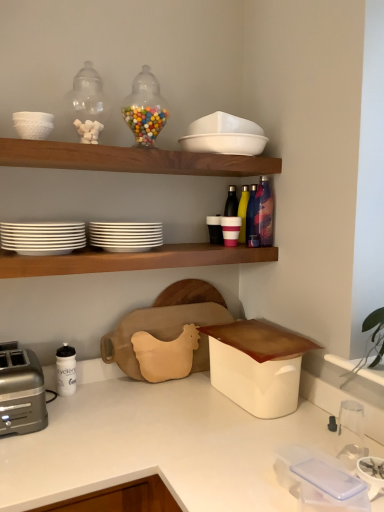
Question: Is metallic multi-colored bottle at upper right, arranged as the third bottle when viewed from the back, looking in the opposite direction of silver metallic toaster at lower left?

Choices:
 (A) no
 (B) yes

Answer: (A)

Question: Is metallic multi-colored bottle at upper right, the 1th bottle viewed from the front, positioned beyond the bounds of silver metallic toaster at lower left?

Choices:
 (A) yes
 (B) no

Answer: (A)

Question: Does metallic multi-colored bottle at upper right, the 1th bottle viewed from the front, have a smaller size compared to silver metallic toaster at lower left?

Choices:
 (A) no
 (B) yes

Answer: (B)

Question: Considering the relative positions of metallic multi-colored bottle at upper right, arranged as the third bottle when viewed from the back, and silver metallic toaster at lower left in the image provided, is metallic multi-colored bottle at upper right, arranged as the third bottle when viewed from the back, to the left of silver metallic toaster at lower left from the viewer's perspective?

Choices:
 (A) no
 (B) yes

Answer: (A)

Question: Is the depth of metallic multi-colored bottle at upper right, arranged as the third bottle when viewed from the back, greater than that of silver metallic toaster at lower left?

Choices:
 (A) yes
 (B) no

Answer: (A)

Question: From the image's perspective, is wooden shelf at upper center, the second shelf when ordered from bottom to top, located above or below translucent glass jar at upper center, which is the seventh tableware in bottom-to-top order?

Choices:
 (A) below
 (B) above

Answer: (A)

Question: Do you think wooden shelf at upper center, acting as the first shelf starting from the top, is within translucent glass jar at upper center, the first tableware when ordered from top to bottom, or outside of it?

Choices:
 (A) outside
 (B) inside

Answer: (A)

Question: Considering the positions of wooden shelf at upper center, acting as the first shelf starting from the top, and translucent glass jar at upper center, which is the seventh tableware in bottom-to-top order, in the image, is wooden shelf at upper center, acting as the first shelf starting from the top, bigger or smaller than translucent glass jar at upper center, which is the seventh tableware in bottom-to-top order,?

Choices:
 (A) small
 (B) big

Answer: (B)

Question: Considering the relative positions of wooden shelf at upper center, acting as the first shelf starting from the top, and translucent glass jar at upper center, which is the seventh tableware in bottom-to-top order, in the image provided, is wooden shelf at upper center, acting as the first shelf starting from the top, to the left or to the right of translucent glass jar at upper center, which is the seventh tableware in bottom-to-top order,?

Choices:
 (A) left
 (B) right

Answer: (A)

Question: From the image's perspective, is translucent glass jar at upper center, the first tableware when ordered from top to bottom, positioned above or below silver metallic toaster at lower left?

Choices:
 (A) above
 (B) below

Answer: (A)

Question: In the image, is translucent glass jar at upper center, the first tableware when ordered from top to bottom, positioned in front of or behind silver metallic toaster at lower left?

Choices:
 (A) behind
 (B) front

Answer: (A)

Question: Is translucent glass jar at upper center, the first tableware when ordered from top to bottom, to the left or to the right of silver metallic toaster at lower left in the image?

Choices:
 (A) right
 (B) left

Answer: (A)

Question: Is point (142, 111) positioned closer to the camera than point (19, 367)?

Choices:
 (A) farther
 (B) closer

Answer: (A)

Question: From the image's perspective, is metallic blue water bottle at upper right, the second bottle in the front-to-back sequence, located above or below yellow matte bottle at upper right, which ranks as the third bottle in front-to-back order?

Choices:
 (A) above
 (B) below

Answer: (B)

Question: Looking at their shapes, would you say metallic blue water bottle at upper right, the second bottle in the front-to-back sequence, is wider or thinner than yellow matte bottle at upper right, which ranks as the third bottle in front-to-back order?

Choices:
 (A) thin
 (B) wide

Answer: (A)